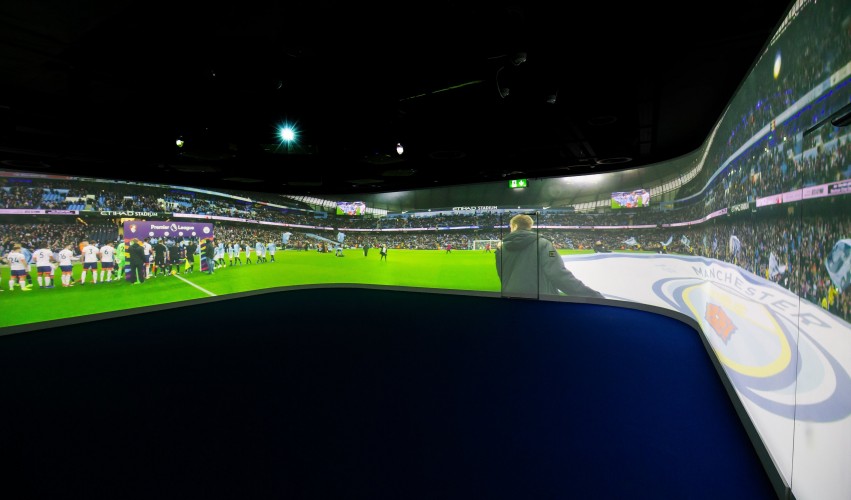
Find the location of a particular element. This screenshot has width=851, height=500. walls with image projected on them is located at coordinates (120, 258), (454, 232), (760, 231).